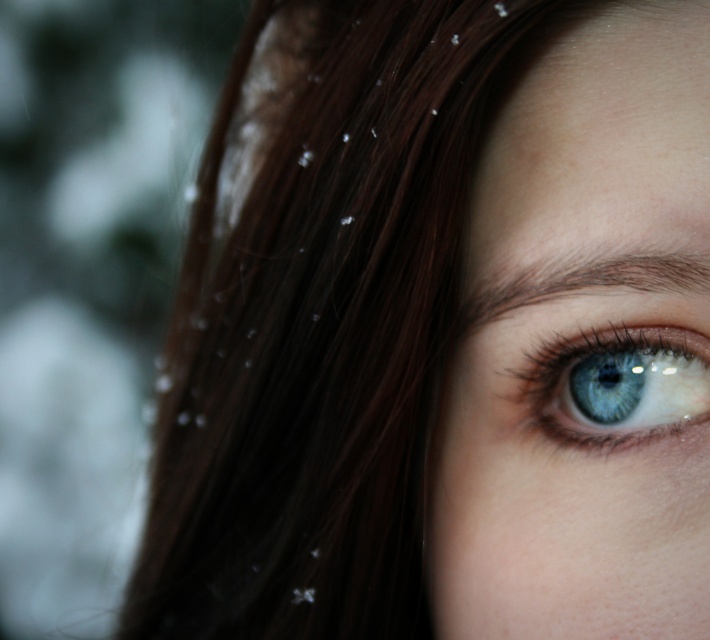
You are a photographer adjusting the lighting to highlight the blue glossy eye at center without losing details in the matte brown hair at upper right. Which object should you focus on first to ensure both are properly lit?

The matte brown hair at upper right is positioned over the blue glossy eye at center, so you should focus on lighting the matte brown hair at upper right first to prevent shadows from obscuring the eye.

You are a photographer adjusting the focus on a camera. You notice the matte brown hair at upper right and the blue glossy eye at center in your viewfinder. Which object should you focus on to ensure it appears sharp if the other is slightly out of focus?

You should focus on the matte brown hair at upper right because it is closer to the viewer than the blue glossy eye at center, so focusing on the closer object will keep it sharp while the farther one may blur.